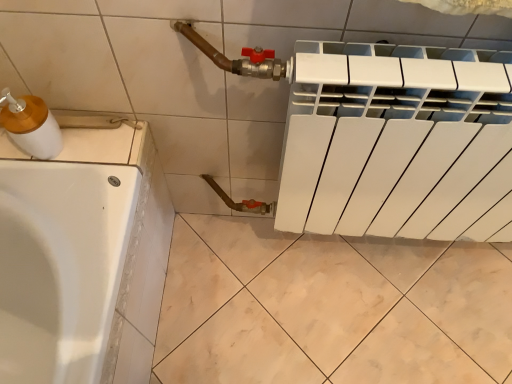
Question: Considering the relative sizes of white plastic sink at left and matte white soap dispenser at left in the image provided, is white plastic sink at left taller than matte white soap dispenser at left?

Choices:
 (A) yes
 (B) no

Answer: (B)

Question: Is white plastic sink at left to the left of matte white soap dispenser at left from the viewer's perspective?

Choices:
 (A) yes
 (B) no

Answer: (A)

Question: Could matte white soap dispenser at left be considered to be inside white plastic sink at left?

Choices:
 (A) no
 (B) yes

Answer: (A)

Question: Does white plastic sink at left have a larger size compared to matte white soap dispenser at left?

Choices:
 (A) yes
 (B) no

Answer: (A)

Question: From a real-world perspective, is white plastic sink at left positioned over matte white soap dispenser at left based on gravity?

Choices:
 (A) yes
 (B) no

Answer: (B)

Question: Does white plastic sink at left have a lesser height compared to matte white soap dispenser at left?

Choices:
 (A) yes
 (B) no

Answer: (A)

Question: Considering the relative sizes of matte white soap dispenser at left and white plastic sink at left in the image provided, is matte white soap dispenser at left shorter than white plastic sink at left?

Choices:
 (A) no
 (B) yes

Answer: (A)

Question: From the image's perspective, does matte white soap dispenser at left appear lower than white plastic sink at left?

Choices:
 (A) yes
 (B) no

Answer: (B)

Question: Considering the relative positions of matte white soap dispenser at left and white plastic sink at left in the image provided, is matte white soap dispenser at left in front of white plastic sink at left?

Choices:
 (A) no
 (B) yes

Answer: (B)

Question: From a real-world perspective, is matte white soap dispenser at left positioned over white plastic sink at left based on gravity?

Choices:
 (A) no
 (B) yes

Answer: (B)

Question: Are matte white soap dispenser at left and white plastic sink at left far apart?

Choices:
 (A) no
 (B) yes

Answer: (A)

Question: Considering the relative sizes of matte white soap dispenser at left and white plastic sink at left in the image provided, is matte white soap dispenser at left bigger than white plastic sink at left?

Choices:
 (A) yes
 (B) no

Answer: (B)

Question: Do you think matte white soap dispenser at left is within white plastic sink at left, or outside of it?

Choices:
 (A) outside
 (B) inside

Answer: (A)